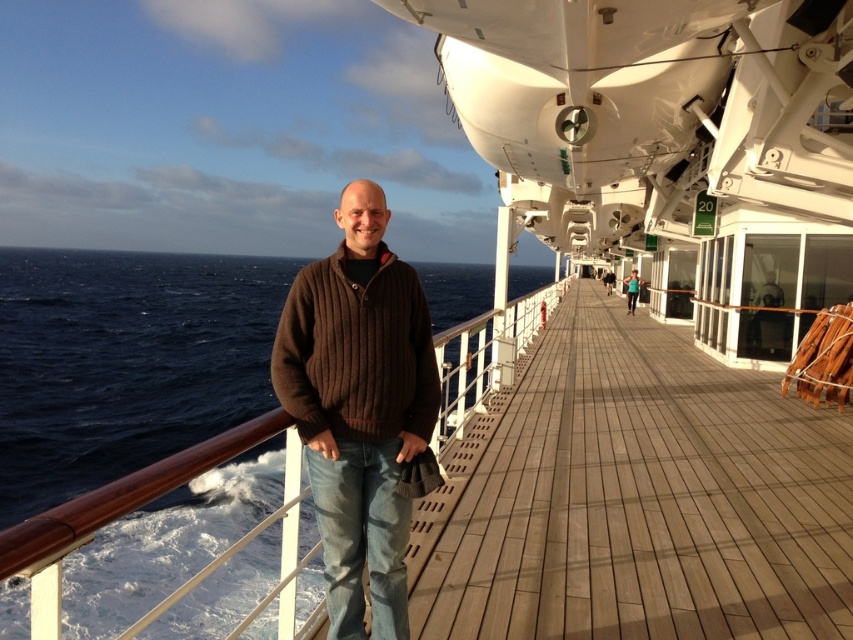
Is point (329, 333) farther from camera compared to point (291, 332)?

No, (329, 333) is closer to viewer.

Who is taller, brown ribbed sweater at center or brown knitted sweater at center?

brown ribbed sweater at center is taller.

Who is more distant from viewer, (x=399, y=432) or (x=322, y=362)?

The point (x=399, y=432) is more distant.

Where is `brown ribbed sweater at center`? brown ribbed sweater at center is located at coordinates (358, 406).

Image resolution: width=853 pixels, height=640 pixels. What do you see at coordinates (358, 406) in the screenshot? I see `brown ribbed sweater at center` at bounding box center [358, 406].

Between brown ribbed sweater at center and matte brown sweater at center, which one is positioned higher?

matte brown sweater at center is above.

Between point (294, 381) and point (636, 269), which one is positioned in front?

Point (294, 381)

This screenshot has height=640, width=853. What are the coordinates of `brown ribbed sweater at center` in the screenshot? It's located at (358, 406).

Does brown knitted sweater at center come in front of matte brown sweater at center?

Yes, it is in front of matte brown sweater at center.

Does brown knitted sweater at center have a lesser width compared to matte brown sweater at center?

Indeed, brown knitted sweater at center has a lesser width compared to matte brown sweater at center.

Which is in front, point (401, 426) or point (633, 291)?

Point (401, 426) is in front.

At what (x,y) coordinates should I click in order to perform the action: click on brown knitted sweater at center. Please return your answer as a coordinate pair (x, y). Looking at the image, I should click on (357, 353).